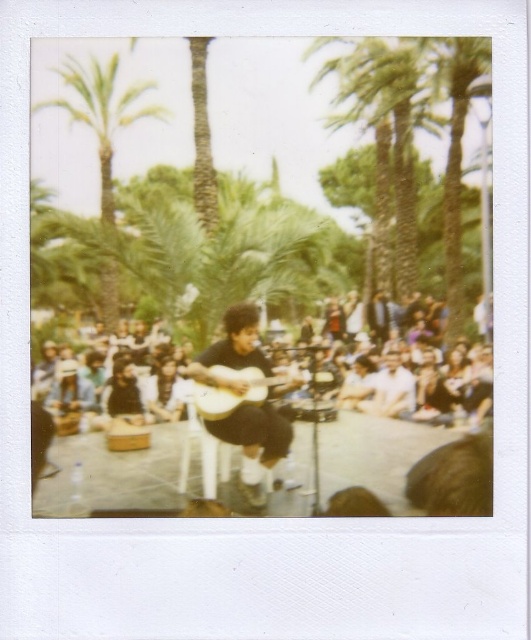
Question: Which is farther from the green leafy palm tree at upper left?

Choices:
 (A) dark brown fabric crowd at center
 (B) matte black guitar at center
 (C) wooden acoustic guitar at center

Answer: (B)

Question: Which point is closer to the camera?

Choices:
 (A) (381, 388)
 (B) (232, 342)

Answer: (B)

Question: In this image, where is dark brown fabric crowd at center located relative to wooden acoustic guitar at center?

Choices:
 (A) right
 (B) left

Answer: (A)

Question: Estimate the real-world distances between objects in this image. Which object is closer to the dark brown fabric crowd at center?

Choices:
 (A) wooden acoustic guitar at center
 (B) matte black guitar at center

Answer: (A)

Question: Does green leafy palm tree at upper left appear over wooden acoustic guitar at center?

Choices:
 (A) no
 (B) yes

Answer: (B)

Question: Is dark brown fabric crowd at center below green leafy palm tree at upper left?

Choices:
 (A) no
 (B) yes

Answer: (B)